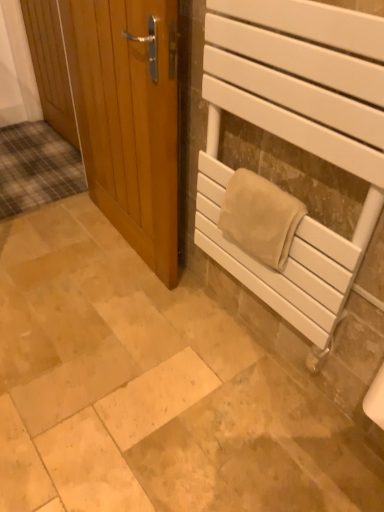
Question: Does light brown wooden door at left, placed as the first door when sorted from right to left, appear on the left side of beige soft towel at right?

Choices:
 (A) yes
 (B) no

Answer: (A)

Question: Is the position of light brown wooden door at left, arranged as the 2th door when viewed from the back, less distant than that of beige soft towel at right?

Choices:
 (A) no
 (B) yes

Answer: (A)

Question: Considering the relative sizes of light brown wooden door at left, the second door from the left, and beige soft towel at right in the image provided, is light brown wooden door at left, the second door from the left, bigger than beige soft towel at right?

Choices:
 (A) yes
 (B) no

Answer: (A)

Question: Is light brown wooden door at left, arranged as the 2th door when viewed from the back, oriented towards beige soft towel at right?

Choices:
 (A) no
 (B) yes

Answer: (A)

Question: From the image's perspective, is light brown wooden door at left, placed as the first door when sorted from right to left, located beneath beige soft towel at right?

Choices:
 (A) no
 (B) yes

Answer: (A)

Question: From the image's perspective, is white matte towel rack at right positioned above or below beige soft towel at right?

Choices:
 (A) below
 (B) above

Answer: (B)

Question: Does point (221, 193) appear closer or farther from the camera than point (223, 210)?

Choices:
 (A) farther
 (B) closer

Answer: (A)

Question: Which is correct: white matte towel rack at right is inside beige soft towel at right, or outside of it?

Choices:
 (A) inside
 (B) outside

Answer: (B)

Question: From their relative heights in the image, would you say white matte towel rack at right is taller or shorter than beige soft towel at right?

Choices:
 (A) tall
 (B) short

Answer: (A)

Question: Is beige soft towel at right spatially inside wooden door at left, which is counted as the first door, starting from the back, or outside of it?

Choices:
 (A) inside
 (B) outside

Answer: (B)

Question: In the image, is beige soft towel at right positioned in front of or behind wooden door at left, which is counted as the first door, starting from the back?

Choices:
 (A) front
 (B) behind

Answer: (A)

Question: Would you say beige soft towel at right is to the left or to the right of wooden door at left, the second door when ordered from right to left, in the picture?

Choices:
 (A) right
 (B) left

Answer: (A)

Question: From the image's perspective, is beige soft towel at right located above or below wooden door at left, which is counted as the first door, starting from the back?

Choices:
 (A) above
 (B) below

Answer: (B)

Question: Based on their sizes in the image, would you say light brown wooden door at left, the second door from the left, is bigger or smaller than wooden door at left, marked as the second door in a front-to-back arrangement?

Choices:
 (A) small
 (B) big

Answer: (B)

Question: From their relative heights in the image, would you say light brown wooden door at left, the 1th door in the front-to-back sequence, is taller or shorter than wooden door at left, the second door when ordered from right to left?

Choices:
 (A) short
 (B) tall

Answer: (B)